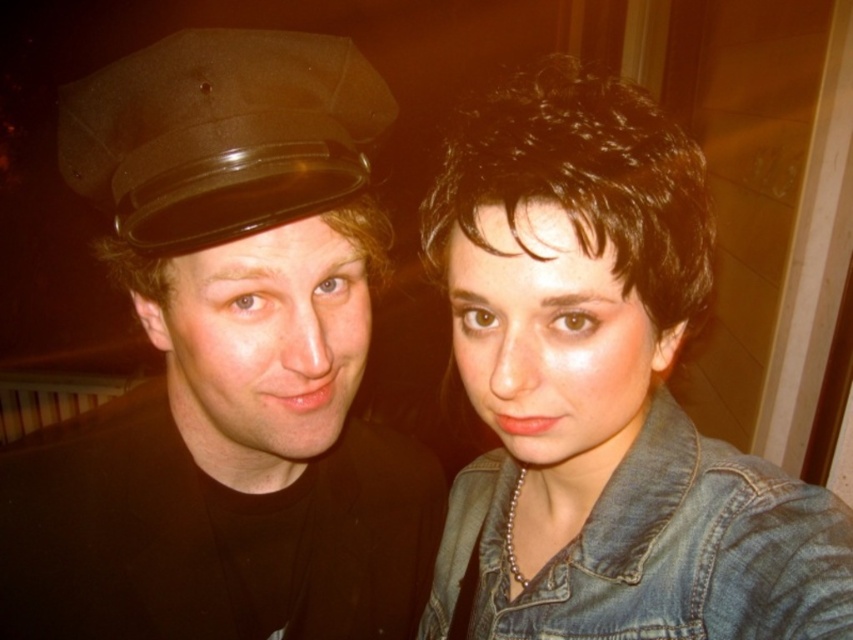
Who is higher up, faded denim jacket at lower right or shiny brown hat at upper left?

Positioned higher is shiny brown hat at upper left.

Who is lower down, faded denim jacket at lower right or shiny brown hat at upper left?

faded denim jacket at lower right

Identify the location of faded denim jacket at lower right. The image size is (853, 640). (654, 550).

Can you confirm if matte black hat at left is smaller than shiny brown hat at upper left?

Actually, matte black hat at left might be larger than shiny brown hat at upper left.

Identify the location of matte black hat at left. (227, 364).

You are a GUI agent. You are given a task and a screenshot of the screen. Output one action in this format:
    pyautogui.click(x=<x>, y=<y>)
    Task: Click on the matte black hat at left
    
    Given the screenshot: What is the action you would take?
    pyautogui.click(x=227, y=364)

Does point (508, 464) lie in front of point (659, 413)?

No.

Which is below, denim jacket at upper right or faded denim jacket at lower right?

faded denim jacket at lower right is lower down.

I want to click on denim jacket at upper right, so click(x=602, y=392).